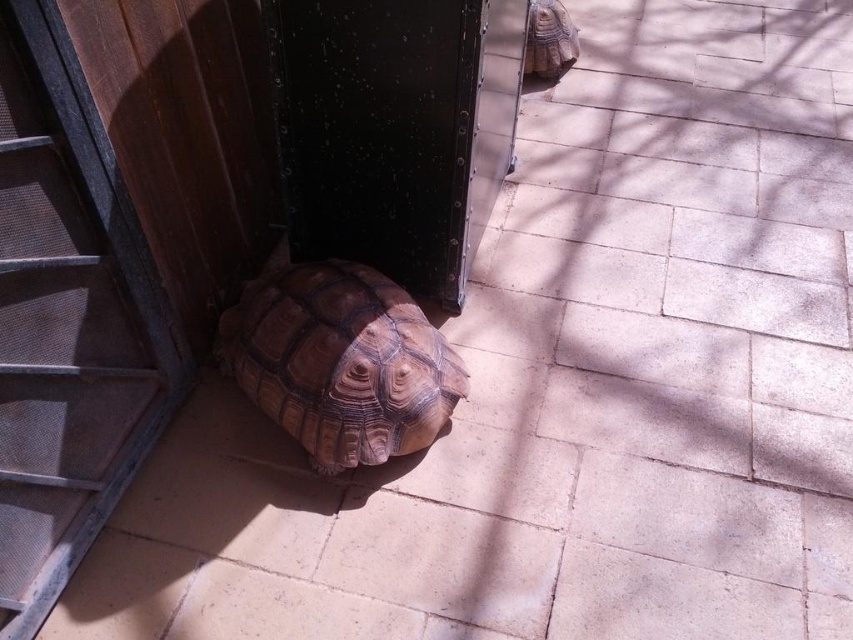
Question: Which object is farther from the camera taking this photo?

Choices:
 (A) transparent glass door at lower left
 (B) brown textured tortoise at upper right

Answer: (B)

Question: Estimate the real-world distances between objects in this image. Which object is closer to the brown textured tortoise at lower left?

Choices:
 (A) transparent glass door at lower left
 (B) brown textured tortoise at upper right

Answer: (A)

Question: Which point is farther from the camera taking this photo?

Choices:
 (A) (283, 280)
 (B) (572, 56)
 (C) (33, 550)

Answer: (B)

Question: Can you confirm if transparent glass door at lower left is positioned below brown textured tortoise at lower left?

Choices:
 (A) yes
 (B) no

Answer: (B)

Question: Can you confirm if brown textured tortoise at lower left is wider than brown textured tortoise at upper right?

Choices:
 (A) yes
 (B) no

Answer: (A)

Question: Is transparent glass door at lower left positioned behind brown textured tortoise at upper right?

Choices:
 (A) yes
 (B) no

Answer: (B)